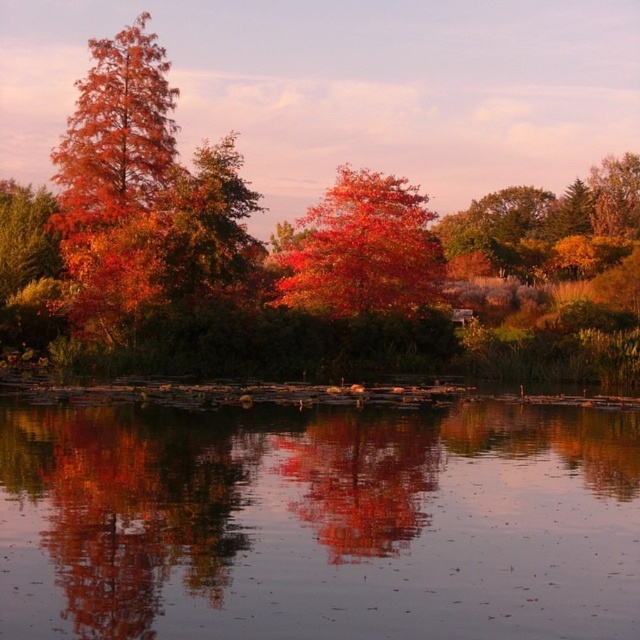
Question: Which of these objects is positioned farthest from the smooth reflective water at center?

Choices:
 (A) reflective glass surface at center
 (B) shiny red leaves at center
 (C) autumn foliage at center
 (D) shiny metallic leaves at center

Answer: (C)

Question: Where is smooth reflective water at center located in relation to autumn foliage at center in the image?

Choices:
 (A) right
 (B) left

Answer: (A)

Question: Does shiny orange tree at left have a lesser width compared to reflective glass surface at center?

Choices:
 (A) yes
 (B) no

Answer: (B)

Question: Based on their relative distances, which object is farther from the autumn foliage at center?

Choices:
 (A) shiny metallic leaves at center
 (B) smooth reflective water at center

Answer: (A)

Question: Observing the image, what is the correct spatial positioning of shiny orange tree at left in reference to shiny red leaves at center?

Choices:
 (A) above
 (B) below

Answer: (A)

Question: Estimate the real-world distances between objects in this image. Which object is farther from the shiny red leaves at center?

Choices:
 (A) reflective glass surface at center
 (B) shiny orange tree at left
 (C) shiny metallic leaves at center
 (D) autumn foliage at center

Answer: (C)